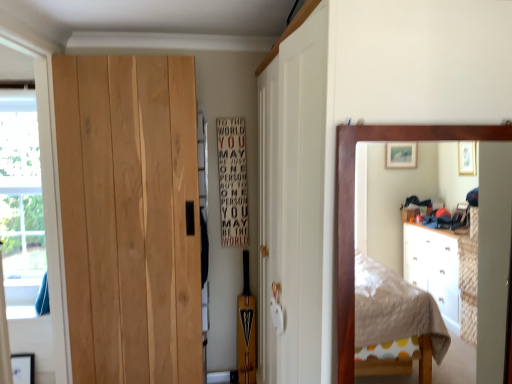
Where is `wooden mirror at right`? Image resolution: width=512 pixels, height=384 pixels. wooden mirror at right is located at coordinates (354, 205).

Describe the element at coordinates (232, 181) in the screenshot. I see `white wood sign at center` at that location.

Describe the element at coordinates (130, 216) in the screenshot. I see `natural wood door at left` at that location.

Where is `wooden mirror at right`? This screenshot has height=384, width=512. wooden mirror at right is located at coordinates (x=354, y=205).

Based on their positions, is white wood sign at center located to the left or right of transparent plastic window screen at left?

white wood sign at center is to the right of transparent plastic window screen at left.

I want to click on window screen to the left of white wood sign at center, so click(x=21, y=189).

Can you tell me how much white wood sign at center and transparent plastic window screen at left differ in facing direction?

The facing directions of white wood sign at center and transparent plastic window screen at left are 0.263 degrees apart.

Is transparent plastic window screen at left at the back of white wood sign at center?

No, transparent plastic window screen at left is not at the back of white wood sign at center.

Based on the photo, from a real-world perspective, is transparent plastic window screen at left located higher than white wood sign at center?

Actually, transparent plastic window screen at left is physically below white wood sign at center in the real world.

Between transparent plastic window screen at left and white wood sign at center, which one has less height?

white wood sign at center.

Does point (33, 114) come behind point (228, 195)?

No, it is in front of (228, 195).

From the image's perspective, is white wood sign at center under wooden mirror at right?

No.

Which object is positioned more to the right, white wood sign at center or wooden mirror at right?

wooden mirror at right.

Does white wood sign at center have a lesser height compared to wooden mirror at right?

In fact, white wood sign at center may be taller than wooden mirror at right.

Would you say white wood sign at center is inside or outside wooden mirror at right?

white wood sign at center cannot be found inside wooden mirror at right.

Can you confirm if wooden mirror at right is thinner than white wood sign at center?

In fact, wooden mirror at right might be wider than white wood sign at center.

Measure the distance from wooden mirror at right to white wood sign at center.

The distance of wooden mirror at right from white wood sign at center is 5.20 feet.

Is point (340, 281) positioned behind point (222, 176)?

No, (340, 281) is in front of (222, 176).

Is wooden mirror at right oriented away from white wood sign at center?

Correct, wooden mirror at right is looking away from white wood sign at center.

Based on their positions, is wooden mirror at right located to the left or right of natural wood door at left?

wooden mirror at right is to the right of natural wood door at left.

Could you tell me if wooden mirror at right is turned towards natural wood door at left?

No, wooden mirror at right is not oriented towards natural wood door at left.

Who is more distant, wooden mirror at right or natural wood door at left?

natural wood door at left is further from the camera.

Considering the relative sizes of wooden mirror at right and natural wood door at left in the image provided, is wooden mirror at right thinner than natural wood door at left?

Yes.

Is transparent plastic window screen at left smaller than wooden mirror at right?

Actually, transparent plastic window screen at left might be larger than wooden mirror at right.

Is wooden mirror at right surrounded by transparent plastic window screen at left?

That's incorrect, wooden mirror at right is not inside transparent plastic window screen at left.

From the image's perspective, between transparent plastic window screen at left and wooden mirror at right, which one is located above?

transparent plastic window screen at left is shown above in the image.

Could you tell me if transparent plastic window screen at left is facing wooden mirror at right?

No, transparent plastic window screen at left is not oriented towards wooden mirror at right.

Is white wood sign at center far away from natural wood door at left?

They are positioned close to each other.

Between point (237, 151) and point (167, 72), which one is positioned behind?

The point (237, 151) is behind.

Which is in front, white wood sign at center or natural wood door at left?

natural wood door at left.

The image size is (512, 384). Identify the location of window screen behind the white wood sign at center. (21, 189).

This screenshot has width=512, height=384. In order to click on window screen directly beneath the white wood sign at center (from a real-world perspective) in this screenshot , I will do `click(21, 189)`.

Looking at the image, which one is located further to wooden mirror at right, transparent plastic window screen at left or natural wood door at left?

transparent plastic window screen at left is further to wooden mirror at right.

Considering their positions, is transparent plastic window screen at left positioned further to white wood sign at center than wooden mirror at right?

The object further to white wood sign at center is wooden mirror at right.

Which object lies nearer to the anchor point white wood sign at center, transparent plastic window screen at left or natural wood door at left?

natural wood door at left is positioned closer to the anchor white wood sign at center.

When comparing their distances from wooden mirror at right, does white wood sign at center or transparent plastic window screen at left seem closer?

white wood sign at center is closer to wooden mirror at right.

From the image, which object appears to be farther from wooden mirror at right, white wood sign at center or natural wood door at left?

The object further to wooden mirror at right is white wood sign at center.

Based on the photo, estimate the real-world distances between objects in this image. Which object is closer to transparent plastic window screen at left, natural wood door at left or wooden mirror at right?

natural wood door at left is positioned closer to the anchor transparent plastic window screen at left.

From the image, which object appears to be farther from wooden mirror at right, transparent plastic window screen at left or white wood sign at center?

transparent plastic window screen at left lies further to wooden mirror at right than the other object.

When comparing their distances from wooden mirror at right, does natural wood door at left or transparent plastic window screen at left seem further?

transparent plastic window screen at left is further to wooden mirror at right.

Image resolution: width=512 pixels, height=384 pixels. What are the coordinates of `door located between transparent plastic window screen at left and wooden mirror at right in the left-right direction` in the screenshot? It's located at (130, 216).

Identify the location of door between wooden mirror at right and white wood sign at center along the z-axis. (130, 216).

You are a GUI agent. You are given a task and a screenshot of the screen. Output one action in this format:
    pyautogui.click(x=<x>, y=<y>)
    Task: Click on the door situated between transparent plastic window screen at left and white wood sign at center from left to right
    This screenshot has width=512, height=384.
    Given the screenshot: What is the action you would take?
    pyautogui.click(x=130, y=216)

At what (x,y) coordinates should I click in order to perform the action: click on bulletin board situated between transparent plastic window screen at left and wooden mirror at right from left to right. Please return your answer as a coordinate pair (x, y). This screenshot has width=512, height=384. Looking at the image, I should click on (232, 181).